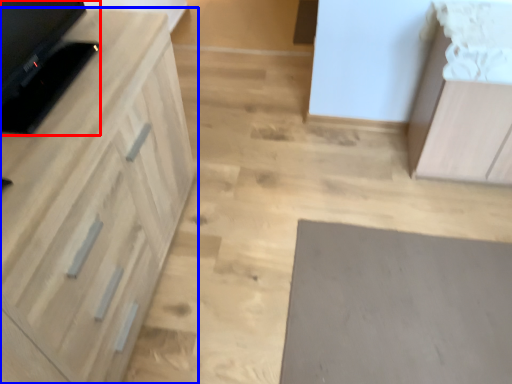
Question: Which object is further to the camera taking this photo, appliance (highlighted by a red box) or cabinetry (highlighted by a blue box)?

Choices:
 (A) appliance
 (B) cabinetry

Answer: (A)